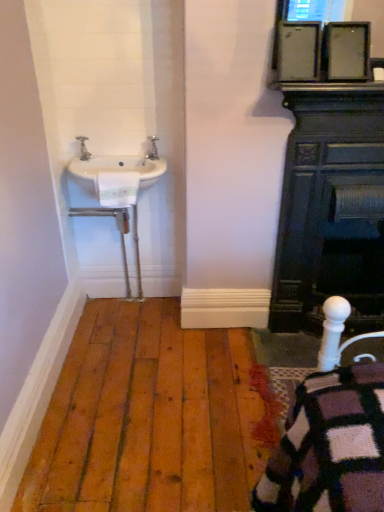
Question: Is silver metallic tap at upper left, the first tap from the left, bigger than white ceramic sink at left?

Choices:
 (A) yes
 (B) no

Answer: (B)

Question: From a real-world perspective, is silver metallic tap at upper left, the first tap from the left, physically below white ceramic sink at left?

Choices:
 (A) no
 (B) yes

Answer: (A)

Question: From the image's perspective, is silver metallic tap at upper left, the first tap from the left, located above white ceramic sink at left?

Choices:
 (A) no
 (B) yes

Answer: (B)

Question: From the image's perspective, is silver metallic tap at upper left, which is the 2th tap from right to left, located beneath white ceramic sink at left?

Choices:
 (A) no
 (B) yes

Answer: (A)

Question: Does silver metallic tap at upper left, which is the 2th tap from right to left, have a smaller size compared to white ceramic sink at left?

Choices:
 (A) yes
 (B) no

Answer: (A)

Question: Is point (81, 480) positioned closer to the camera than point (382, 233)?

Choices:
 (A) closer
 (B) farther

Answer: (A)

Question: In the image, is natural wood floor at lower left on the left side or the right side of black cast iron fireplace at right?

Choices:
 (A) left
 (B) right

Answer: (A)

Question: From the image's perspective, is natural wood floor at lower left located above or below black cast iron fireplace at right?

Choices:
 (A) below
 (B) above

Answer: (A)

Question: From a real-world perspective, relative to black cast iron fireplace at right, is natural wood floor at lower left vertically above or below?

Choices:
 (A) above
 (B) below

Answer: (B)

Question: Is white ceramic sink at left taller or shorter than polished brass faucet at upper left, the second tap when ordered from left to right?

Choices:
 (A) short
 (B) tall

Answer: (B)

Question: Considering the positions of white ceramic sink at left and polished brass faucet at upper left, the second tap when ordered from left to right, in the image, is white ceramic sink at left wider or thinner than polished brass faucet at upper left, the second tap when ordered from left to right,?

Choices:
 (A) wide
 (B) thin

Answer: (A)

Question: From a real-world perspective, is white ceramic sink at left physically located above or below polished brass faucet at upper left, the 1th tap in the right-to-left sequence?

Choices:
 (A) above
 (B) below

Answer: (B)

Question: Is white ceramic sink at left in front of or behind polished brass faucet at upper left, the second tap when ordered from left to right, in the image?

Choices:
 (A) front
 (B) behind

Answer: (A)

Question: From a real-world perspective, is polished brass faucet at upper left, the 1th tap in the right-to-left sequence, above or below white ceramic sink at left?

Choices:
 (A) below
 (B) above

Answer: (B)

Question: Looking at the image, does polished brass faucet at upper left, the 1th tap in the right-to-left sequence, seem bigger or smaller compared to white ceramic sink at left?

Choices:
 (A) big
 (B) small

Answer: (B)